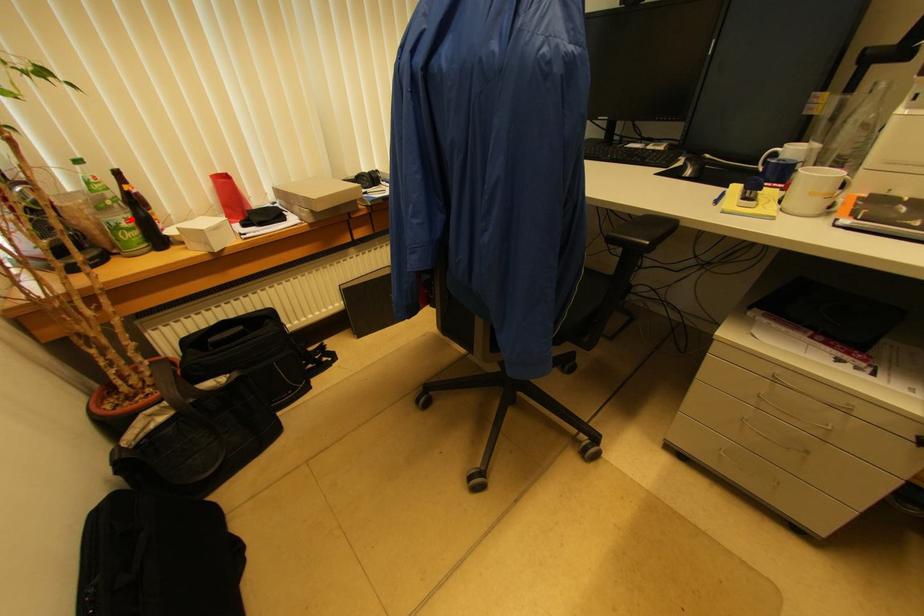
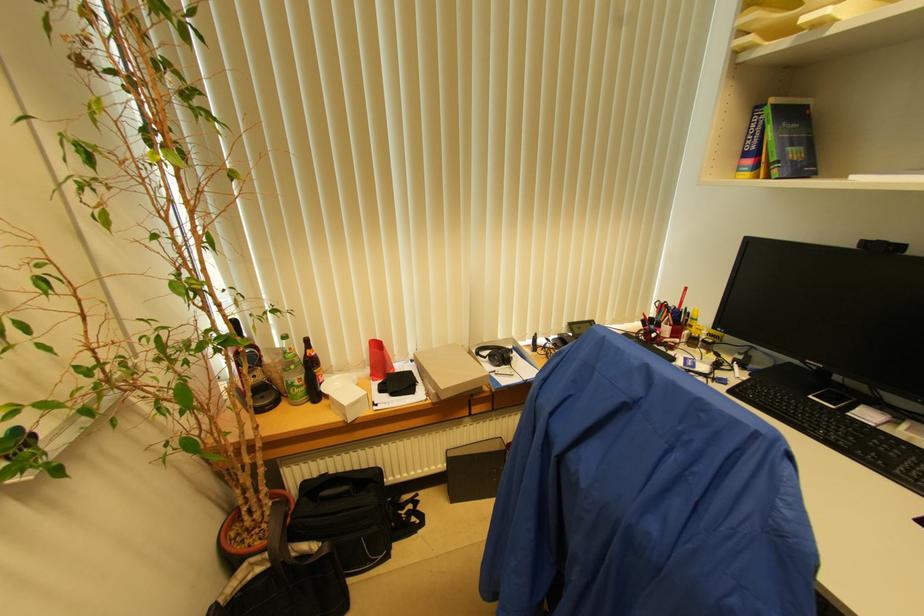
Locate, in the second image, the point that corresponds to the highlighted location in the first image.

(304, 379)